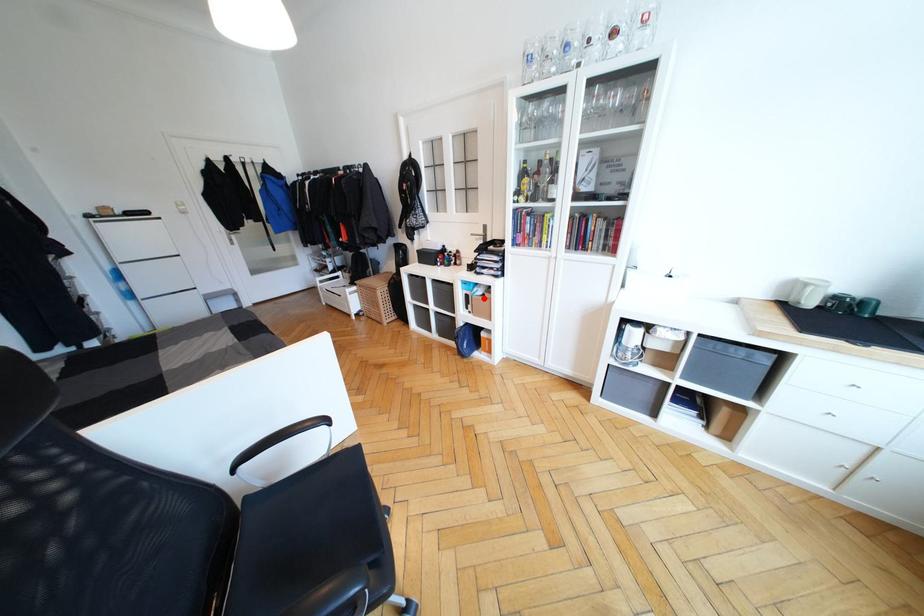
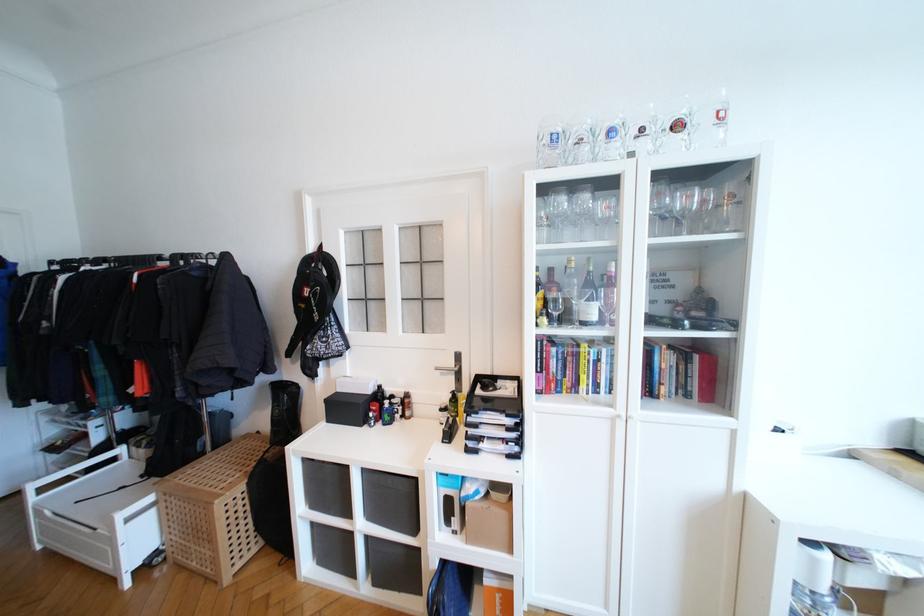
Question: I am providing you with two images of the same scene from different viewpoints. Given a red point in image1, look at the same physical point in image2. Is it:

Choices:
 (A) Closer to the viewpoint
 (B) Farther from the viewpoint

Answer: (B)